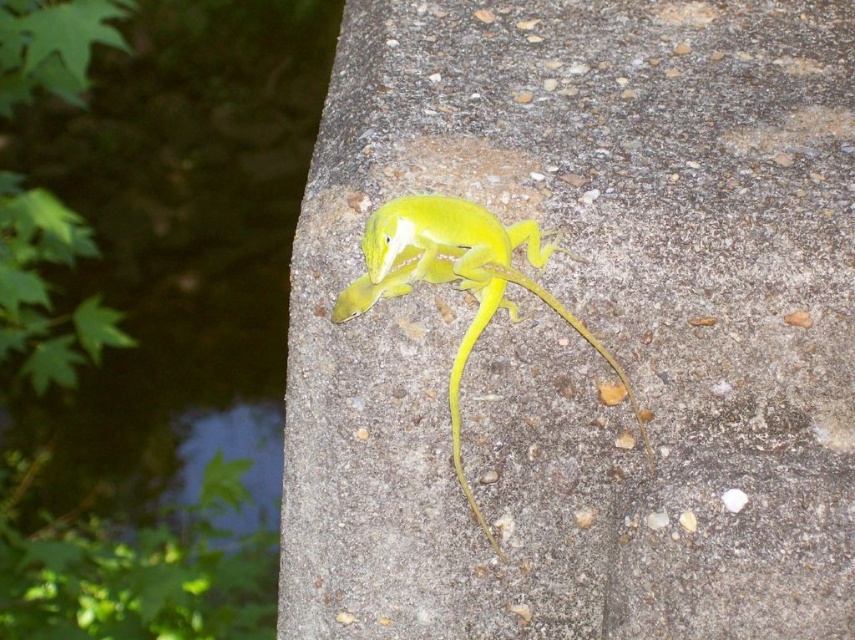
You are a photographer aiming to capture the green matte lizard at center and the smooth concrete at center in a single shot. Which object should you focus on first to ensure both are in sharp focus?

You should focus on the green matte lizard at center first because it is closer to you than the smooth concrete at center, which is further away. By focusing on the closer object, the depth of field may extend to include the background object as well.

You are a photographer trying to capture the green matte lizard at center. You notice the smooth concrete at center in the background. Which object is positioned higher in the frame?

The smooth concrete at center is above the green matte lizard at center, so the smooth concrete at center is positioned higher in the frame.

You are a small insect observing the scene. You want to climb onto the smooth concrete at center from the ground. Is the green matte lizard at center in your way?

The smooth concrete at center has a greater height compared to green matte lizard at center, so the lizard is not blocking your path to the concrete. You can climb onto the smooth concrete at center without the green matte lizard at center being in your way.